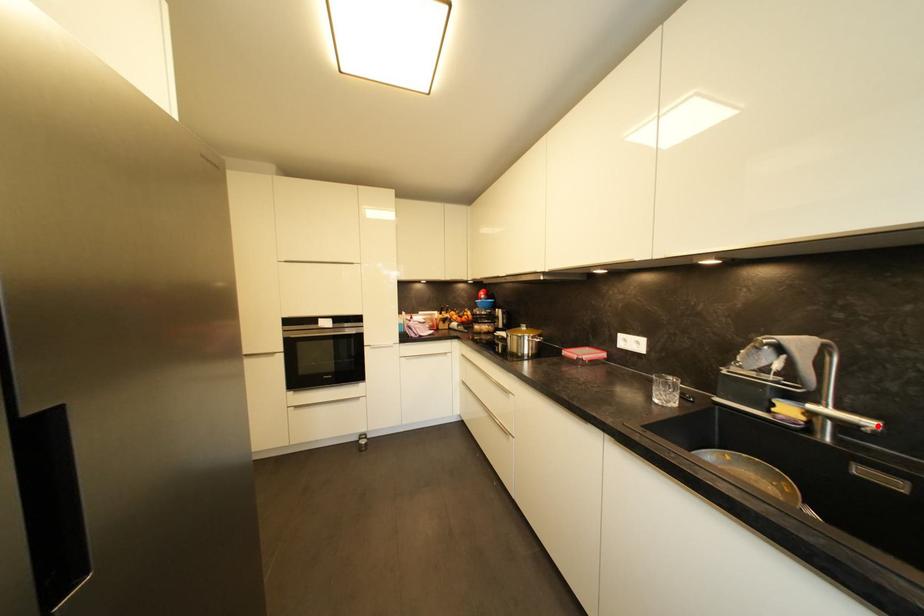
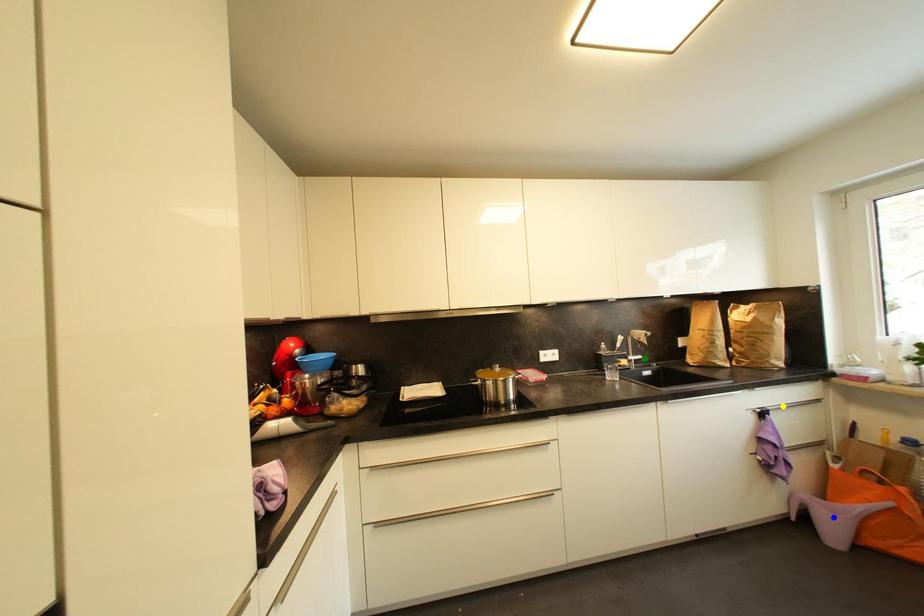
Question: I am providing you with two images of the same scene from different viewpoints. A red point is marked on the first image. You are given multiple points on the second image. Which spot in image 2 lines up with the point in image 1?

Choices:
 (A) green point
 (B) yellow point
 (C) blue point

Answer: (A)